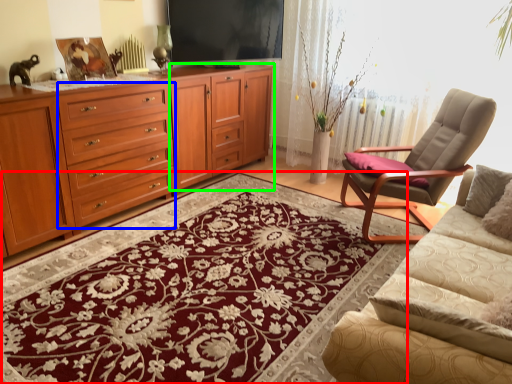
Question: Based on their relative distances, which object is nearer to mat (highlighted by a red box)? Choose from drawer (highlighted by a blue box) and tv cabinet (highlighted by a green box).

Choices:
 (A) drawer
 (B) tv cabinet

Answer: (A)